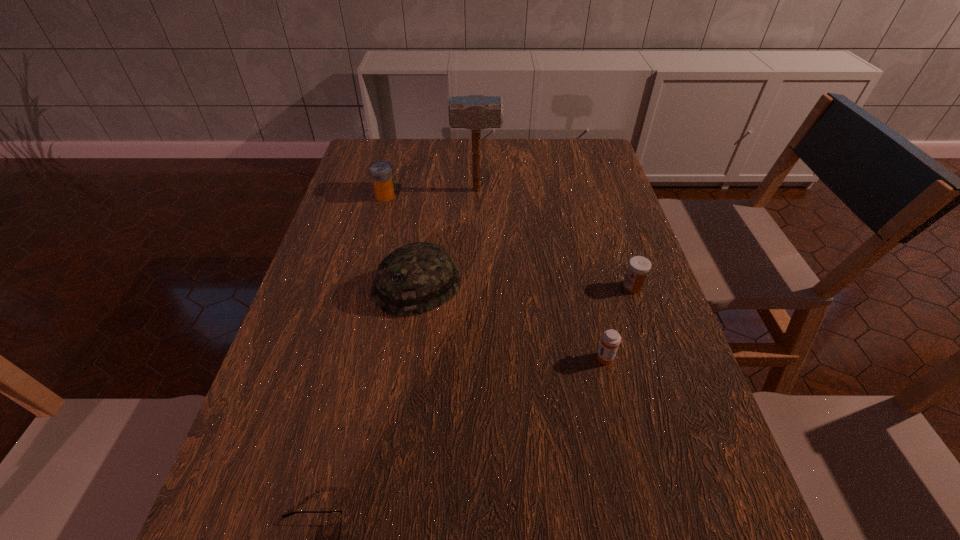
Locate an element on the screen. vacant point that satisfies the following two spatial constraints: 1. on the striking face of the tallest object; 2. on the left side of the second farthest medicine is located at coordinates (475, 287).

I want to click on free space that satisfies the following two spatial constraints: 1. on the striking face of the mallet; 2. on the front side of the headwear, so click(475, 287).

Where is `vacant region that satisfies the following two spatial constraints: 1. on the striking face of the second medicine from right to left; 2. on the left side of the mallet`? The height and width of the screenshot is (540, 960). vacant region that satisfies the following two spatial constraints: 1. on the striking face of the second medicine from right to left; 2. on the left side of the mallet is located at coordinates (475, 357).